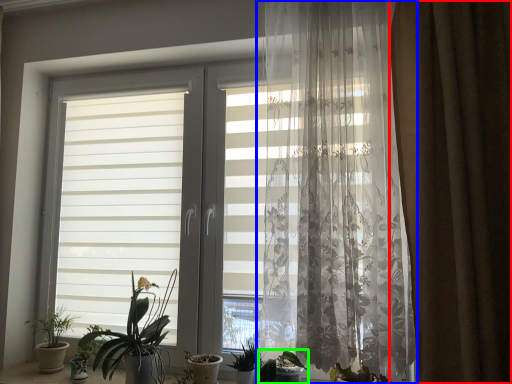
Question: Which is nearer to the curtain (highlighted by a red box)? curtain (highlighted by a blue box) or houseplant (highlighted by a green box).

Choices:
 (A) curtain
 (B) houseplant

Answer: (A)